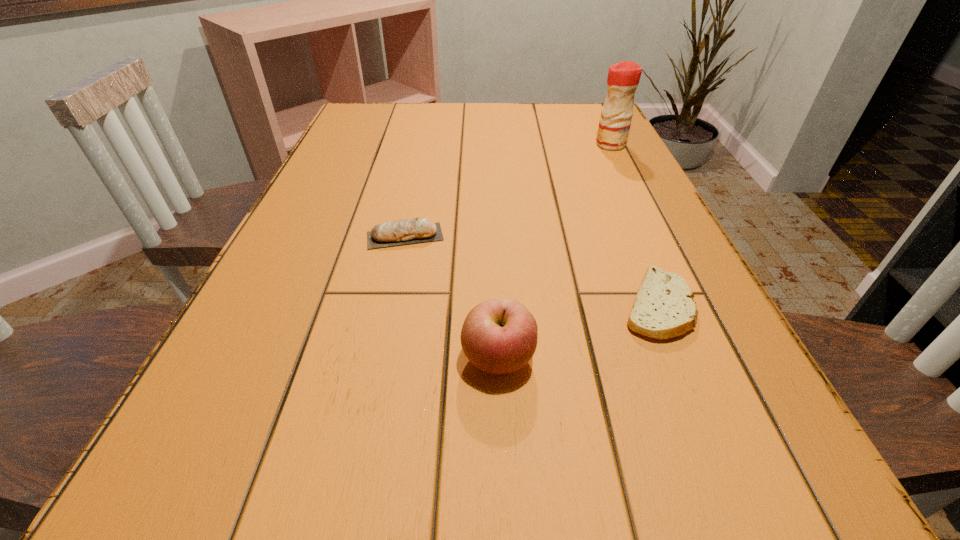
What are the coordinates of `free location located 0.070m on the back of the leftmost object` in the screenshot? It's located at (412, 205).

You are a GUI agent. You are given a task and a screenshot of the screen. Output one action in this format:
    pyautogui.click(x=<x>, y=<y>)
    Task: Click on the vacant space situated on the left of the right pita bread
    The width and height of the screenshot is (960, 540).
    Given the screenshot: What is the action you would take?
    pyautogui.click(x=447, y=306)

What are the coordinates of `condiment that is at the right edge` in the screenshot? It's located at (623, 78).

This screenshot has width=960, height=540. I want to click on pita bread positioned at the right edge, so click(x=663, y=308).

At what (x,y) coordinates should I click in order to perform the action: click on free region at the far edge of the desktop. Please return your answer as a coordinate pair (x, y). Looking at the image, I should click on (498, 130).

The width and height of the screenshot is (960, 540). Find the location of `free point at the near edge`. free point at the near edge is located at coordinates (474, 525).

In the image, there is a desktop. Where is `free space at the left edge`? This screenshot has height=540, width=960. free space at the left edge is located at coordinates (338, 145).

Where is `free region at the right edge of the desktop`? The height and width of the screenshot is (540, 960). free region at the right edge of the desktop is located at coordinates (666, 222).

Where is `vacant space at the near left corner`? vacant space at the near left corner is located at coordinates (233, 521).

Where is `vacant space at the far right corner of the desktop`? Image resolution: width=960 pixels, height=540 pixels. vacant space at the far right corner of the desktop is located at coordinates (561, 114).